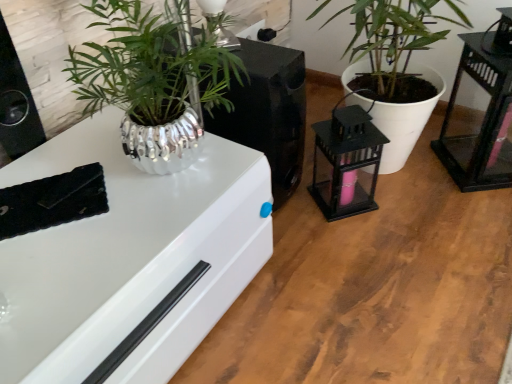
Question: Is black metal lantern at center-right, the first appliance in the right-to-left sequence, in contact with metallic silver plant pot at upper left, which ranks as the 1th appliance in left-to-right order?

Choices:
 (A) yes
 (B) no

Answer: (B)

Question: Can you confirm if black metal lantern at center-right, acting as the 2th appliance starting from the left, is positioned to the right of metallic silver plant pot at upper left, which ranks as the 1th appliance in left-to-right order?

Choices:
 (A) no
 (B) yes

Answer: (B)

Question: Is metallic silver plant pot at upper left, which ranks as the 1th appliance in left-to-right order, inside black metal lantern at center-right, the first appliance in the right-to-left sequence?

Choices:
 (A) no
 (B) yes

Answer: (A)

Question: Is black metal lantern at center-right, acting as the 2th appliance starting from the left, positioned far away from metallic silver plant pot at upper left, which ranks as the 1th appliance in left-to-right order?

Choices:
 (A) no
 (B) yes

Answer: (A)

Question: From the image's perspective, is black metal lantern at center-right, acting as the 2th appliance starting from the left, under metallic silver plant pot at upper left, which ranks as the 1th appliance in left-to-right order?

Choices:
 (A) yes
 (B) no

Answer: (A)

Question: Can you confirm if black metal lantern at center-right, acting as the 2th appliance starting from the left, is shorter than metallic silver plant pot at upper left, acting as the 2th appliance starting from the right?

Choices:
 (A) yes
 (B) no

Answer: (A)

Question: Is metallic silver plant pot at upper left, acting as the 2th appliance starting from the right, in contact with black glass table at right?

Choices:
 (A) no
 (B) yes

Answer: (A)

Question: From a real-world perspective, is metallic silver plant pot at upper left, which ranks as the 1th appliance in left-to-right order, on top of black glass table at right?

Choices:
 (A) no
 (B) yes

Answer: (A)

Question: Considering the relative sizes of metallic silver plant pot at upper left, acting as the 2th appliance starting from the right, and black glass table at right in the image provided, is metallic silver plant pot at upper left, acting as the 2th appliance starting from the right, taller than black glass table at right?

Choices:
 (A) no
 (B) yes

Answer: (A)

Question: From the image's perspective, does metallic silver plant pot at upper left, acting as the 2th appliance starting from the right, appear higher than black glass table at right?

Choices:
 (A) no
 (B) yes

Answer: (A)

Question: Is metallic silver plant pot at upper left, which ranks as the 1th appliance in left-to-right order, further to camera compared to black glass table at right?

Choices:
 (A) yes
 (B) no

Answer: (B)

Question: From a real-world perspective, is metallic silver plant pot at upper left, which ranks as the 1th appliance in left-to-right order, beneath black glass table at right?

Choices:
 (A) no
 (B) yes

Answer: (B)

Question: Is black glass table at right taller than white matte plant pot at center?

Choices:
 (A) no
 (B) yes

Answer: (A)